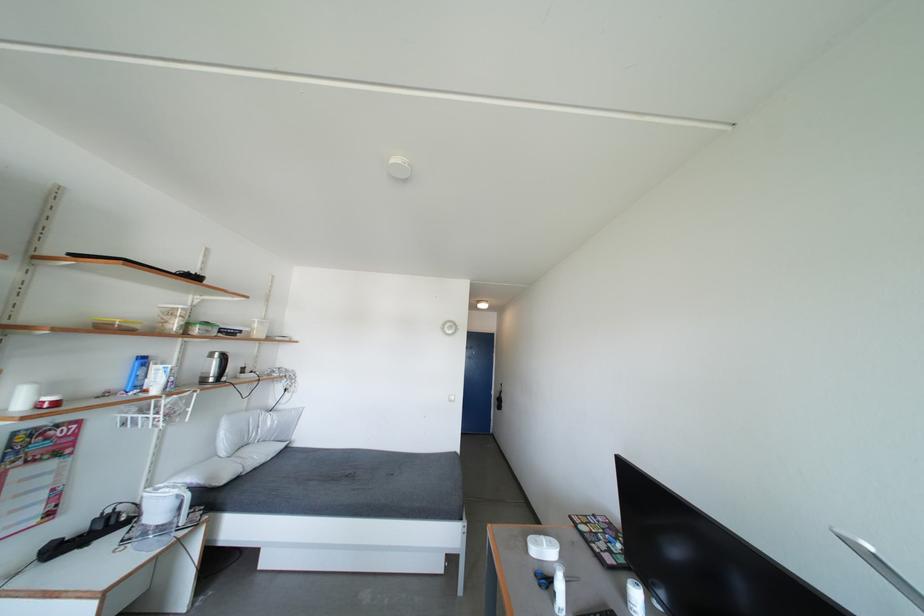
The location [542,546] corresponds to which object?

This point indicates the clear food container.